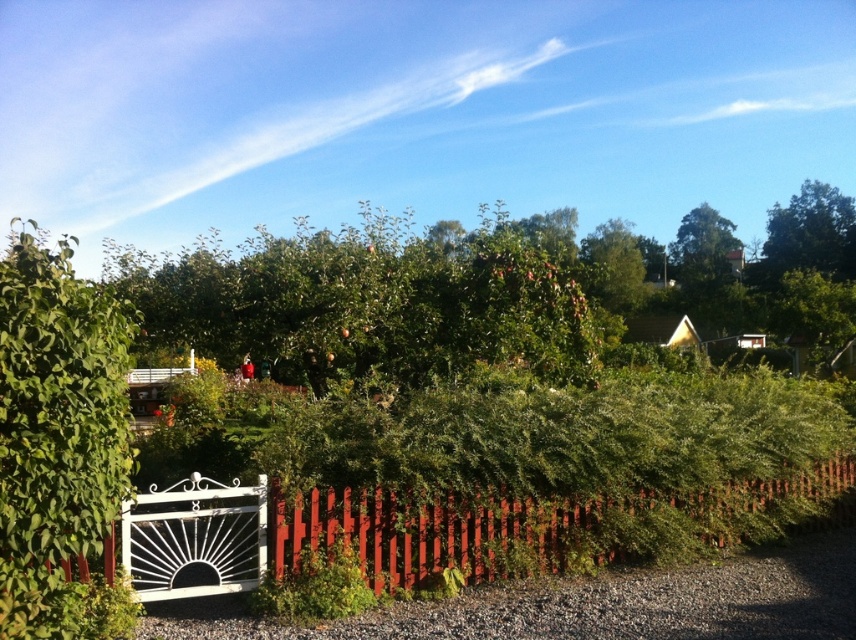
Question: Among these objects, which one is nearest to the camera?

Choices:
 (A) green leafy bush at center
 (B) green leafy tree at upper right

Answer: (A)

Question: Does green leafy tree at center have a lesser width compared to green leafy bush at center?

Choices:
 (A) yes
 (B) no

Answer: (B)

Question: Does green leafy bush at center appear over green leafy tree at upper right?

Choices:
 (A) no
 (B) yes

Answer: (A)

Question: Does green leafy bush at center appear on the left side of green leafy tree at upper right?

Choices:
 (A) no
 (B) yes

Answer: (B)

Question: Which point appears closest to the camera in this image?

Choices:
 (A) (625, 504)
 (B) (348, 275)
 (C) (21, 392)
 (D) (782, 218)

Answer: (C)

Question: Which point is closer to the camera?

Choices:
 (A) (843, 504)
 (B) (42, 394)
 (C) (562, 376)

Answer: (B)